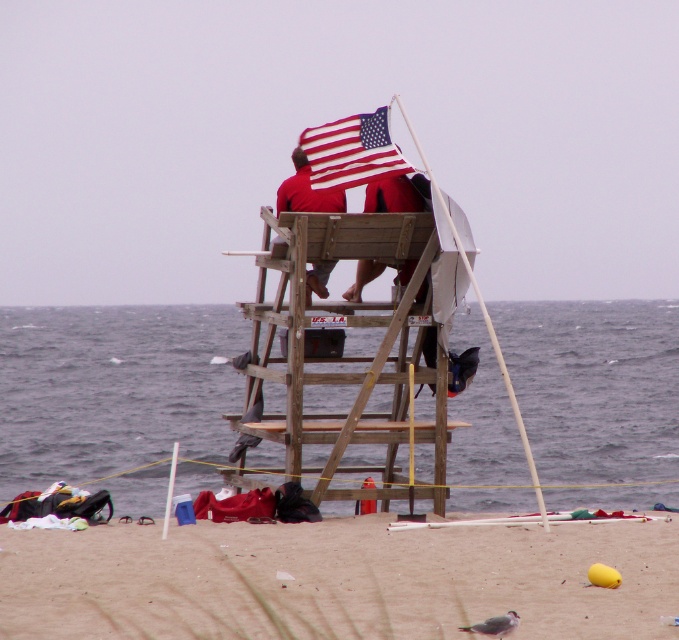
Question: Does smooth sand at lower center appear under matte red shorts at center?

Choices:
 (A) yes
 (B) no

Answer: (A)

Question: Is smooth sand at lower center positioned behind matte red shorts at center?

Choices:
 (A) no
 (B) yes

Answer: (A)

Question: Does smooth sand at lower center have a greater width compared to american flag at center?

Choices:
 (A) no
 (B) yes

Answer: (B)

Question: Which object appears farthest from the camera in this image?

Choices:
 (A) american flag at center
 (B) matte red shorts at center

Answer: (B)

Question: Which object is positioned farthest from the american flag at center?

Choices:
 (A) smooth sand at lower center
 (B) gray water at lower center
 (C) matte red shorts at center
 (D) wooden lifeguard tower at center

Answer: (B)

Question: Which object appears closest to the camera in this image?

Choices:
 (A) american flag at center
 (B) matte red shorts at center
 (C) wooden lifeguard tower at center

Answer: (A)